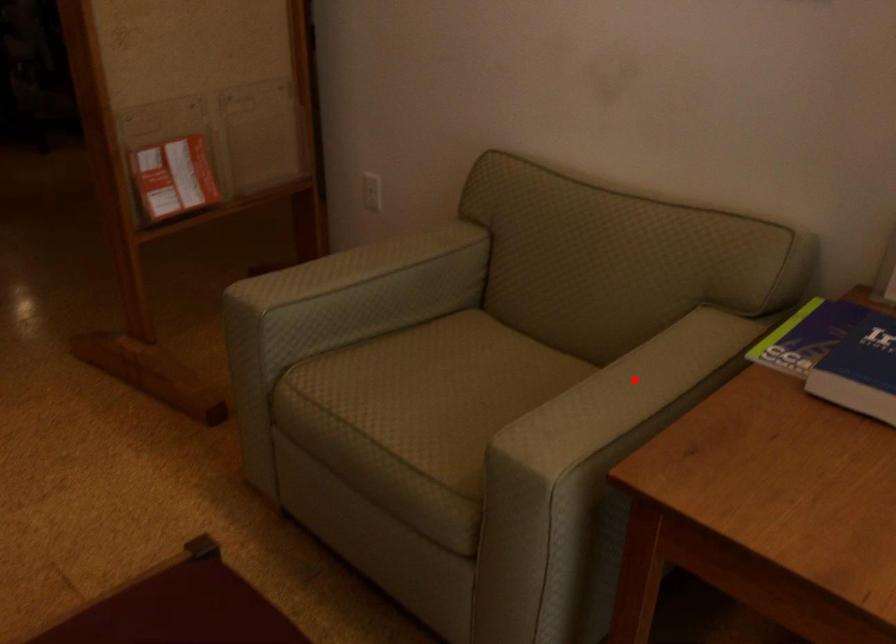
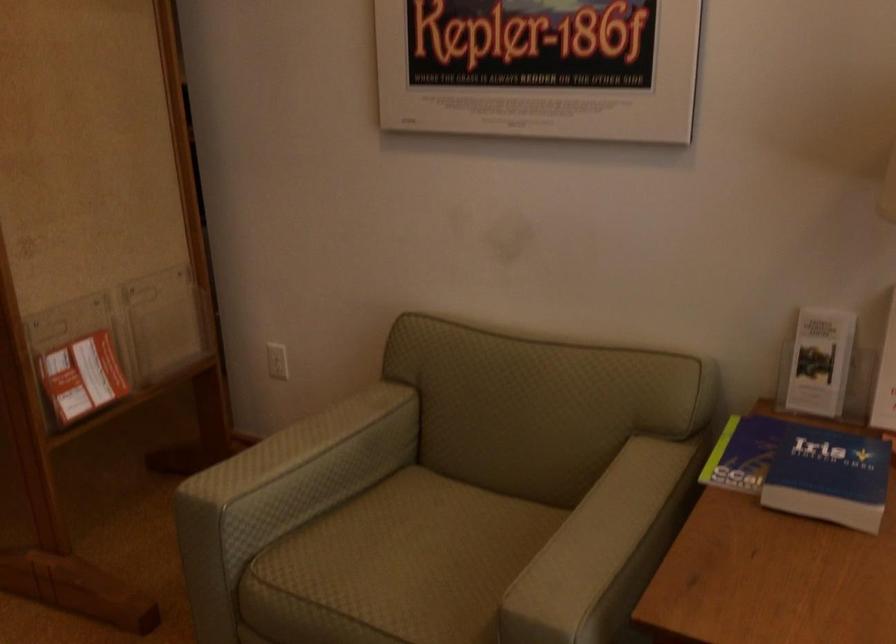
In the second image, find the point that corresponds to the highlighted location in the first image.

(607, 520)